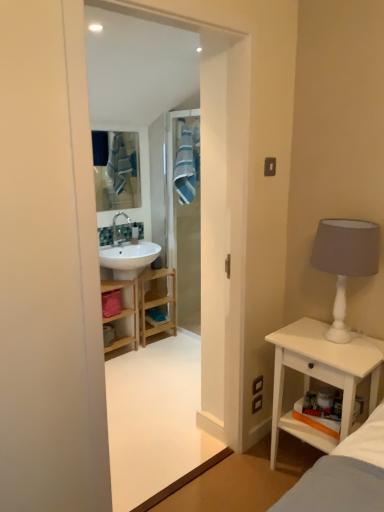
Question: In the image, is white glossy sink at upper left on the left side or the right side of wooden cabinet at center?

Choices:
 (A) left
 (B) right

Answer: (A)

Question: Is white glossy sink at upper left wider or thinner than wooden cabinet at center?

Choices:
 (A) wide
 (B) thin

Answer: (B)

Question: Estimate the real-world distances between objects in this image. Which object is closer to the white glossy sink at upper left?

Choices:
 (A) blue fabric mirror at upper center
 (B) white matte table lamp at right
 (C) blue striped fabric at center
 (D) white wood nightstand at right
 (E) wooden cabinet at center

Answer: (A)

Question: Based on their relative distances, which object is nearer to the white matte table lamp at right?

Choices:
 (A) white wood nightstand at right
 (B) blue fabric mirror at upper center
 (C) white glossy sink at upper left
 (D) wooden cabinet at center
 (E) blue striped fabric at center

Answer: (A)